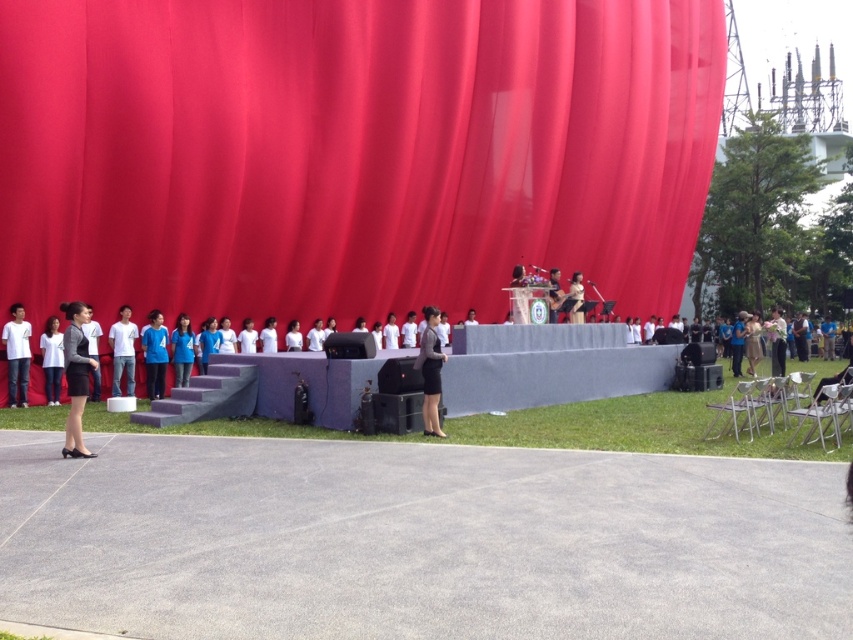
Which of these two, white cotton shirt at left or white matte shirt at center, stands taller?

white cotton shirt at left is taller.

Is white cotton shirt at left taller than white matte shirt at center?

Correct, white cotton shirt at left is much taller as white matte shirt at center.

Locate an element on the screen. white cotton shirt at left is located at coordinates (16, 355).

Between matte red curtain at upper center and white matte shirt at center, which one has less height?

With less height is white matte shirt at center.

Locate an element on the screen. matte red curtain at upper center is located at coordinates (351, 150).

Is point (676, 144) behind point (120, 340)?

Yes, point (676, 144) is farther from viewer.

Locate an element on the screen. The image size is (853, 640). matte red curtain at upper center is located at coordinates click(351, 150).

Does point (293, 289) lie in front of point (15, 323)?

No, it is behind (15, 323).

Who is more forward, (374, 230) or (9, 387)?

Point (9, 387) is in front.

Where is `matte red curtain at upper center`? matte red curtain at upper center is located at coordinates (351, 150).